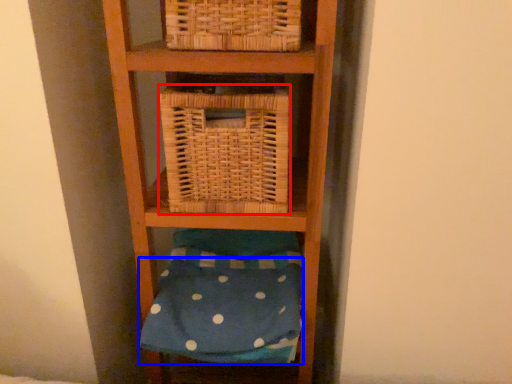
Question: Which point is closer to the camera, basket (highlighted by a red box) or pillow (highlighted by a blue box)?

Choices:
 (A) basket
 (B) pillow

Answer: (A)